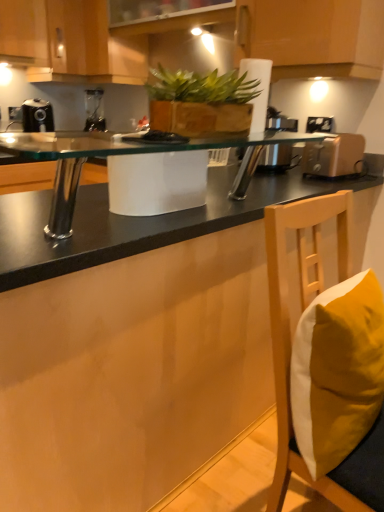
Question: From the image's perspective, is green leafy plant at center located beneath wooden cabinet at upper center, acting as the third cabinetry starting from the left?

Choices:
 (A) no
 (B) yes

Answer: (B)

Question: Is green leafy plant at center thinner than wooden cabinet at upper center, acting as the third cabinetry starting from the left?

Choices:
 (A) no
 (B) yes

Answer: (B)

Question: From a real-world perspective, is green leafy plant at center physically below wooden cabinet at upper center, the first cabinetry positioned from the right?

Choices:
 (A) no
 (B) yes

Answer: (B)

Question: Is green leafy plant at center placed right next to wooden cabinet at upper center, acting as the third cabinetry starting from the left?

Choices:
 (A) no
 (B) yes

Answer: (A)

Question: From the image's perspective, is green leafy plant at center located above wooden cabinet at upper center, the first cabinetry positioned from the right?

Choices:
 (A) yes
 (B) no

Answer: (B)

Question: Considering the relative positions of green leafy plant at center and wooden cabinet at upper center, acting as the third cabinetry starting from the left, in the image provided, is green leafy plant at center to the right of wooden cabinet at upper center, acting as the third cabinetry starting from the left, from the viewer's perspective?

Choices:
 (A) no
 (B) yes

Answer: (A)

Question: Can you confirm if wooden cabinet at upper center, which appears as the second cabinetry when viewed from the left, is shorter than black plastic coffee machine at left?

Choices:
 (A) no
 (B) yes

Answer: (A)

Question: Does wooden cabinet at upper center, positioned as the second cabinetry in right-to-left order, have a lesser width compared to black plastic coffee machine at left?

Choices:
 (A) yes
 (B) no

Answer: (B)

Question: From a real-world perspective, is wooden cabinet at upper center, positioned as the second cabinetry in right-to-left order, on black plastic coffee machine at left?

Choices:
 (A) no
 (B) yes

Answer: (B)

Question: Is there a large distance between wooden cabinet at upper center, which appears as the second cabinetry when viewed from the left, and black plastic coffee machine at left?

Choices:
 (A) yes
 (B) no

Answer: (B)

Question: From a real-world perspective, is wooden cabinet at upper center, positioned as the second cabinetry in right-to-left order, positioned under black plastic coffee machine at left based on gravity?

Choices:
 (A) yes
 (B) no

Answer: (B)

Question: Considering the relative positions of wooden cabinet at upper center, positioned as the second cabinetry in right-to-left order, and black plastic coffee machine at left in the image provided, is wooden cabinet at upper center, positioned as the second cabinetry in right-to-left order, in front of black plastic coffee machine at left?

Choices:
 (A) no
 (B) yes

Answer: (B)

Question: Does matte wood cabinet at upper left, the 3th cabinetry when ordered from right to left, lie in front of black plastic coffee machine at left?

Choices:
 (A) no
 (B) yes

Answer: (B)